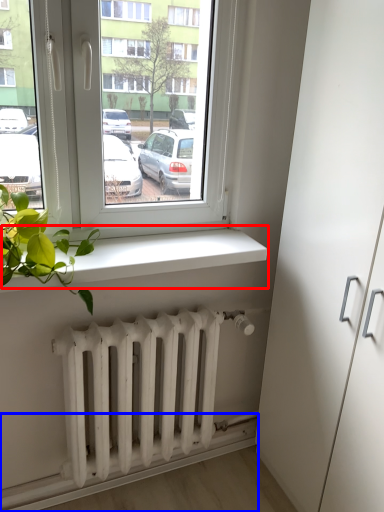
Question: Which of the following is the farthest to the observer, window sill (highlighted by a red box) or ledge (highlighted by a blue box)?

Choices:
 (A) window sill
 (B) ledge

Answer: (B)